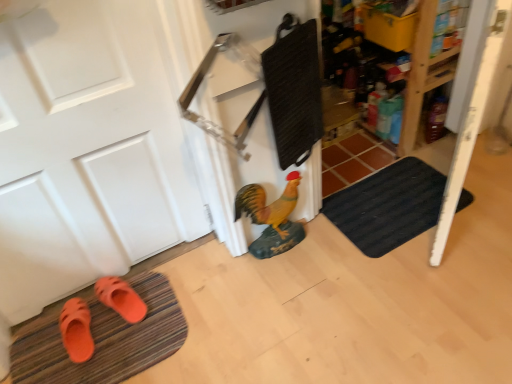
How much space does black textured bath mat at lower right, which appears as the 1th bath mat when viewed from the right, occupy vertically?

1.24 inches.

In order to face white matte door at left, should I rotate leftwards or rightwards?

Rotate your view left by about 24.668°.

What do you see at coordinates (121, 298) in the screenshot? I see `orange rubber slipper at lower left, which ranks as the 2th footwear in left-to-right order` at bounding box center [121, 298].

This screenshot has height=384, width=512. I want to click on black textured bath mat at lower right, the second bath mat positioned from the left, so click(x=388, y=206).

Locate an element on the screen. This screenshot has width=512, height=384. footwear on the left of orange rubber bath mat at lower left, which appears as the second bath mat when viewed from the top is located at coordinates (76, 330).

Could you tell me if orange rubber bath mat at lower left, the first bath mat in the bottom-to-top sequence, is facing orange rubber sandals at lower left, the first footwear viewed from the left?

No, orange rubber bath mat at lower left, the first bath mat in the bottom-to-top sequence, is not aimed at orange rubber sandals at lower left, the first footwear viewed from the left.

How far apart are orange rubber bath mat at lower left, which appears as the 2th bath mat when viewed from the right, and orange rubber sandals at lower left, the first footwear viewed from the left?

They are 11.92 centimeters apart.

Are orange rubber bath mat at lower left, which appears as the 2th bath mat when viewed from the right, and orange rubber sandals at lower left, the 2th footwear viewed from the right, beside each other?

orange rubber bath mat at lower left, which appears as the 2th bath mat when viewed from the right, and orange rubber sandals at lower left, the 2th footwear viewed from the right, are not in contact.

Is orange rubber slipper at lower left, arranged as the 1th footwear when viewed from the right, a part of white matte door at left?

No, white matte door at left does not contain orange rubber slipper at lower left, arranged as the 1th footwear when viewed from the right.

In terms of size, does white matte door at left appear bigger or smaller than orange rubber slipper at lower left, which ranks as the 2th footwear in left-to-right order?

In the image, white matte door at left appears to be larger than orange rubber slipper at lower left, which ranks as the 2th footwear in left-to-right order.

Is white matte door at left at the left side of orange rubber slipper at lower left, arranged as the 1th footwear when viewed from the right?

Correct, you'll find white matte door at left to the left of orange rubber slipper at lower left, arranged as the 1th footwear when viewed from the right.

Is shiny yellow chicken at center not inside orange rubber slipper at lower left, which ranks as the 2th footwear in left-to-right order?

That's correct, shiny yellow chicken at center is outside of orange rubber slipper at lower left, which ranks as the 2th footwear in left-to-right order.

Are shiny yellow chicken at center and orange rubber slipper at lower left, arranged as the 1th footwear when viewed from the right, beside each other?

shiny yellow chicken at center is not next to orange rubber slipper at lower left, arranged as the 1th footwear when viewed from the right, and they're not touching.

What's the angular difference between shiny yellow chicken at center and orange rubber slipper at lower left, arranged as the 1th footwear when viewed from the right,'s facing directions?

There is a 10.5-degree angle between the facing directions of shiny yellow chicken at center and orange rubber slipper at lower left, arranged as the 1th footwear when viewed from the right.

In the scene shown: Between shiny yellow chicken at center and orange rubber slipper at lower left, which ranks as the 2th footwear in left-to-right order, which one is positioned in front?

shiny yellow chicken at center is closer to the camera.

In the scene shown: Does black textured bath mat at lower right, positioned as the first bath mat in top-to-bottom order, touch shiny yellow chicken at center?

No, black textured bath mat at lower right, positioned as the first bath mat in top-to-bottom order, is not making contact with shiny yellow chicken at center.

Is black textured bath mat at lower right, the second bath mat positioned from the left, inside the boundaries of shiny yellow chicken at center, or outside?

black textured bath mat at lower right, the second bath mat positioned from the left, is outside shiny yellow chicken at center.

From the image's perspective, is black textured bath mat at lower right, the second bath mat positioned from the left, beneath shiny yellow chicken at center?

Incorrect, from the image's perspective, black textured bath mat at lower right, the second bath mat positioned from the left, is higher than shiny yellow chicken at center.

From the picture: What's the angular difference between orange rubber sandals at lower left, the 2th footwear viewed from the right, and orange rubber slipper at lower left, arranged as the 1th footwear when viewed from the right,'s facing directions?

11.1 degrees.

Considering the sizes of objects orange rubber sandals at lower left, the first footwear viewed from the left, and orange rubber slipper at lower left, arranged as the 1th footwear when viewed from the right, in the image provided, who is shorter, orange rubber sandals at lower left, the first footwear viewed from the left, or orange rubber slipper at lower left, arranged as the 1th footwear when viewed from the right,?

orange rubber slipper at lower left, arranged as the 1th footwear when viewed from the right, is shorter.

The height and width of the screenshot is (384, 512). What are the coordinates of `footwear that appears below the orange rubber slipper at lower left, arranged as the 1th footwear when viewed from the right (from the image's perspective)` in the screenshot? It's located at (76, 330).

Is orange rubber sandals at lower left, the first footwear viewed from the left, with orange rubber slipper at lower left, which ranks as the 2th footwear in left-to-right order?

No.

Is the depth of orange rubber sandals at lower left, the 2th footwear viewed from the right, greater than that of shiny yellow chicken at center?

No, it is not.

Is orange rubber sandals at lower left, the first footwear viewed from the left, spatially inside shiny yellow chicken at center, or outside of it?

orange rubber sandals at lower left, the first footwear viewed from the left, cannot be found inside shiny yellow chicken at center.

Which of these two, orange rubber sandals at lower left, the first footwear viewed from the left, or shiny yellow chicken at center, is wider?

orange rubber sandals at lower left, the first footwear viewed from the left, is wider.

Measure the distance between orange rubber sandals at lower left, the first footwear viewed from the left, and shiny yellow chicken at center.

orange rubber sandals at lower left, the first footwear viewed from the left, is 28.83 inches from shiny yellow chicken at center.

From a real-world perspective, starting from the white matte door at left, which footwear is the 1st one below it? Please provide its 2D coordinates.

[(76, 330)]

Which object is thinner, white matte door at left or orange rubber sandals at lower left, the first footwear viewed from the left?

With smaller width is white matte door at left.

Does white matte door at left touch orange rubber sandals at lower left, the 2th footwear viewed from the right?

No.

From the image's perspective, is white matte door at left above orange rubber sandals at lower left, the 2th footwear viewed from the right?

Yes, from the image's perspective, white matte door at left is on top of orange rubber sandals at lower left, the 2th footwear viewed from the right.

Image resolution: width=512 pixels, height=384 pixels. Find the location of `bath mat in front of the orange rubber sandals at lower left, the 2th footwear viewed from the right`. bath mat in front of the orange rubber sandals at lower left, the 2th footwear viewed from the right is located at coordinates (105, 341).

At what (x,y) coordinates should I click in order to perform the action: click on door that is above the orange rubber slipper at lower left, arranged as the 1th footwear when viewed from the right (from the image's perspective). Please return your answer as a coordinate pair (x, y). The height and width of the screenshot is (384, 512). Looking at the image, I should click on (86, 151).

Based on their spatial positions, is shiny yellow chicken at center or white matte door at left further from orange rubber bath mat at lower left, which appears as the second bath mat when viewed from the top?

Based on the image, shiny yellow chicken at center appears to be further to orange rubber bath mat at lower left, which appears as the second bath mat when viewed from the top.

Considering their positions, is shiny yellow chicken at center positioned further to orange rubber sandals at lower left, the 2th footwear viewed from the right, than orange rubber slipper at lower left, which ranks as the 2th footwear in left-to-right order?

The object further to orange rubber sandals at lower left, the 2th footwear viewed from the right, is shiny yellow chicken at center.

When comparing their distances from orange rubber sandals at lower left, the first footwear viewed from the left, does black textured bath mat at lower right, positioned as the first bath mat in top-to-bottom order, or orange rubber bath mat at lower left, which appears as the second bath mat when viewed from the top, seem further?

The object further to orange rubber sandals at lower left, the first footwear viewed from the left, is black textured bath mat at lower right, positioned as the first bath mat in top-to-bottom order.

Looking at the image, which one is located closer to shiny yellow chicken at center, orange rubber sandals at lower left, the first footwear viewed from the left, or black textured bath mat at lower right, positioned as the first bath mat in top-to-bottom order?

black textured bath mat at lower right, positioned as the first bath mat in top-to-bottom order, is positioned closer to the anchor shiny yellow chicken at center.

Considering their positions, is black textured bath mat at lower right, which appears as the 1th bath mat when viewed from the right, positioned further to white matte door at left than orange rubber slipper at lower left, arranged as the 1th footwear when viewed from the right?

black textured bath mat at lower right, which appears as the 1th bath mat when viewed from the right, is further to white matte door at left.

Based on their spatial positions, is black textured bath mat at lower right, marked as the 2th bath mat in a bottom-to-top arrangement, or orange rubber bath mat at lower left, which appears as the second bath mat when viewed from the top, closer to shiny yellow chicken at center?

black textured bath mat at lower right, marked as the 2th bath mat in a bottom-to-top arrangement, lies closer to shiny yellow chicken at center than the other object.

Looking at the image, which one is located closer to orange rubber bath mat at lower left, which appears as the 2th bath mat when viewed from the right, orange rubber slipper at lower left, which ranks as the 2th footwear in left-to-right order, or black textured bath mat at lower right, which appears as the 1th bath mat when viewed from the right?

Based on the image, orange rubber slipper at lower left, which ranks as the 2th footwear in left-to-right order, appears to be nearer to orange rubber bath mat at lower left, which appears as the 2th bath mat when viewed from the right.

Based on their spatial positions, is orange rubber sandals at lower left, the 2th footwear viewed from the right, or orange rubber bath mat at lower left, which appears as the second bath mat when viewed from the top, closer to white matte door at left?

Among the two, orange rubber bath mat at lower left, which appears as the second bath mat when viewed from the top, is located nearer to white matte door at left.

This screenshot has height=384, width=512. Find the location of `footwear positioned between orange rubber bath mat at lower left, which appears as the 2th bath mat when viewed from the right, and orange rubber slipper at lower left, arranged as the 1th footwear when viewed from the right, from near to far`. footwear positioned between orange rubber bath mat at lower left, which appears as the 2th bath mat when viewed from the right, and orange rubber slipper at lower left, arranged as the 1th footwear when viewed from the right, from near to far is located at coordinates (76, 330).

You are a GUI agent. You are given a task and a screenshot of the screen. Output one action in this format:
    pyautogui.click(x=<x>, y=<y>)
    Task: Click on the door between orange rubber sandals at lower left, the 2th footwear viewed from the right, and black textured bath mat at lower right, the second bath mat positioned from the left, in the horizontal direction
    The width and height of the screenshot is (512, 384).
    Given the screenshot: What is the action you would take?
    pyautogui.click(x=86, y=151)

Identify the location of bath mat located between white matte door at left and orange rubber slipper at lower left, arranged as the 1th footwear when viewed from the right, in the depth direction. (105, 341).

At what (x,y) coordinates should I click in order to perform the action: click on door located between orange rubber sandals at lower left, the first footwear viewed from the left, and shiny yellow chicken at center in the left-right direction. Please return your answer as a coordinate pair (x, y). Looking at the image, I should click on (86, 151).